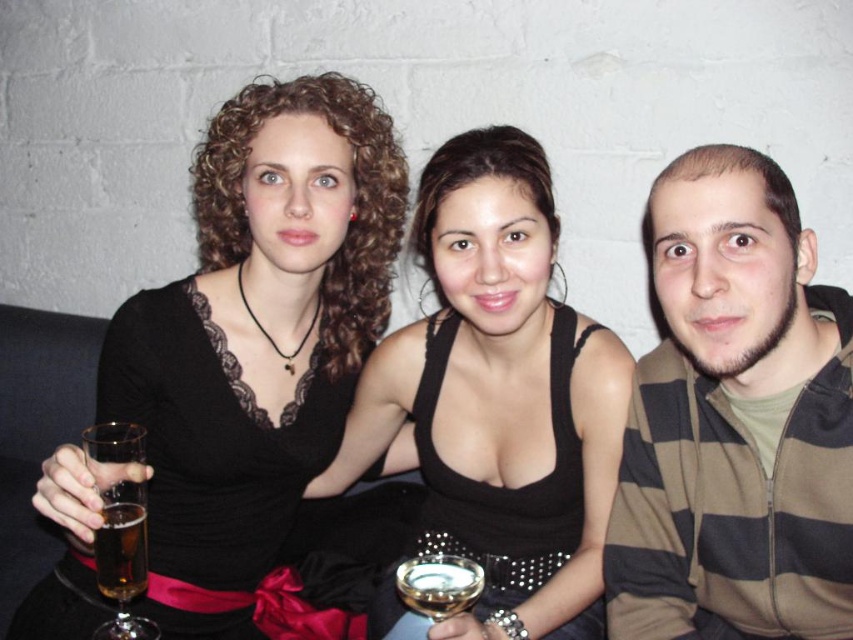
Which of these two, black satin dress at center or translucent glass beer at lower left, stands taller?

With more height is black satin dress at center.

Does black satin dress at center appear on the right side of translucent glass beer at lower left?

Yes, black satin dress at center is to the right of translucent glass beer at lower left.

Locate an element on the screen. Image resolution: width=853 pixels, height=640 pixels. black satin dress at center is located at coordinates (498, 396).

Does translucent glass at left appear over gold metallic wine glass at center?

Yes.

Does translucent glass at left have a larger size compared to gold metallic wine glass at center?

Answer: Indeed, translucent glass at left has a larger size compared to gold metallic wine glass at center.

Find the location of a particular element. This screenshot has height=640, width=853. translucent glass at left is located at coordinates (119, 524).

Which is in front, point (349, 301) or point (471, 253)?

Point (471, 253)

Can you confirm if black lace dress at center is positioned below black satin dress at center?

Actually, black lace dress at center is above black satin dress at center.

Does point (80, 481) lie in front of point (567, 424)?

Yes.

You are a GUI agent. You are given a task and a screenshot of the screen. Output one action in this format:
    pyautogui.click(x=<x>, y=<y>)
    Task: Click on the black lace dress at center
    This screenshot has height=640, width=853.
    Given the screenshot: What is the action you would take?
    pyautogui.click(x=265, y=368)